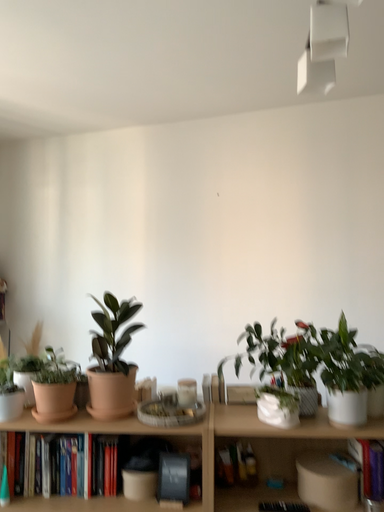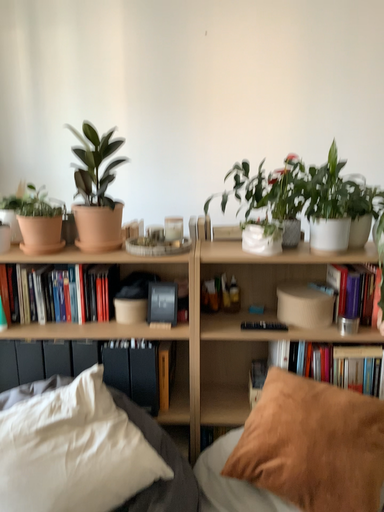
Question: Which way did the camera rotate in the video?

Choices:
 (A) rotated upward
 (B) rotated downward

Answer: (B)